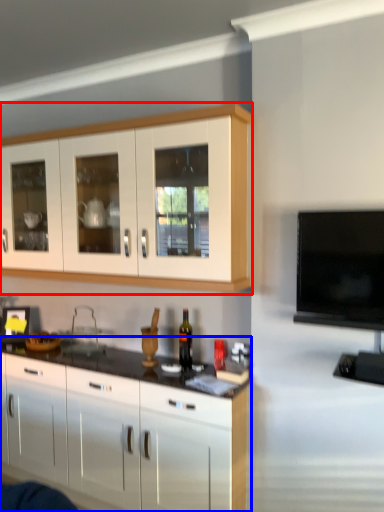
Question: Which object appears farthest to the camera in this image, cabinetry (highlighted by a red box) or cabinetry (highlighted by a blue box)?

Choices:
 (A) cabinetry
 (B) cabinetry

Answer: (B)